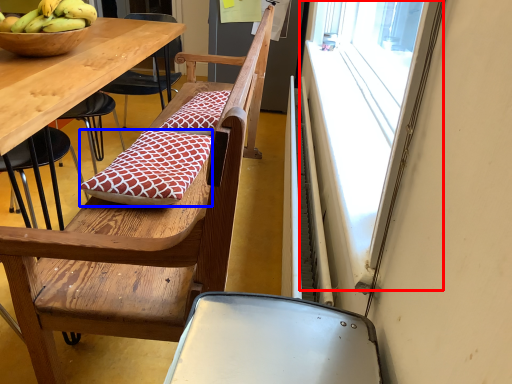
Question: Which object is further to the camera taking this photo, window (highlighted by a red box) or pillow (highlighted by a blue box)?

Choices:
 (A) window
 (B) pillow

Answer: (B)